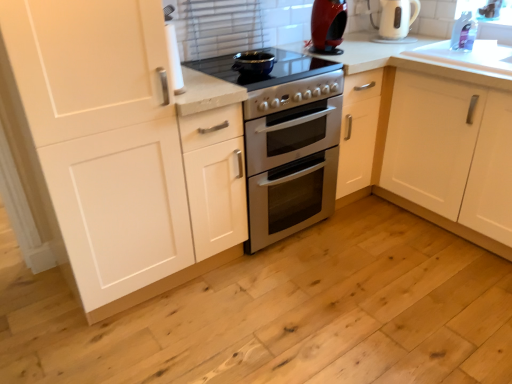
The image size is (512, 384). In order to click on free region under matte black pot at center, arranged as the first appliance when viewed from the top (from a real-world perspective) in this screenshot , I will do `click(251, 67)`.